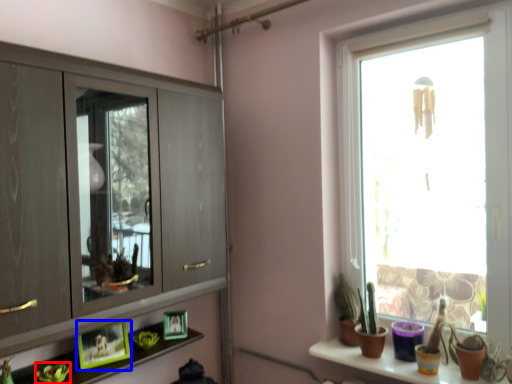
Question: Which of the following is the farthest to the observer, plant (highlighted by a red box) or picture frame (highlighted by a blue box)?

Choices:
 (A) plant
 (B) picture frame

Answer: (B)